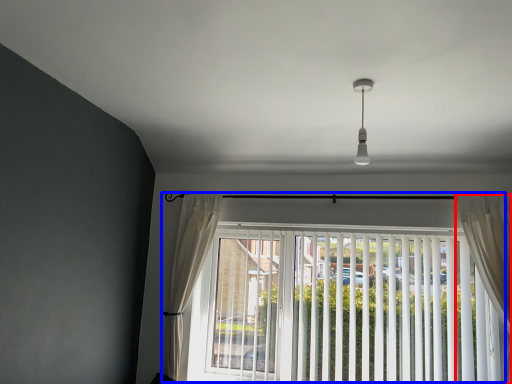
Question: Which of the following is the farthest to the observer, curtain (highlighted by a red box) or window (highlighted by a blue box)?

Choices:
 (A) curtain
 (B) window

Answer: (B)